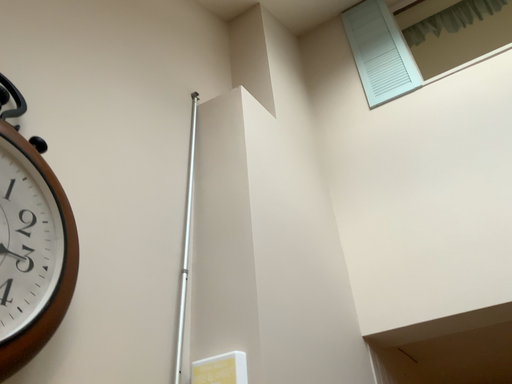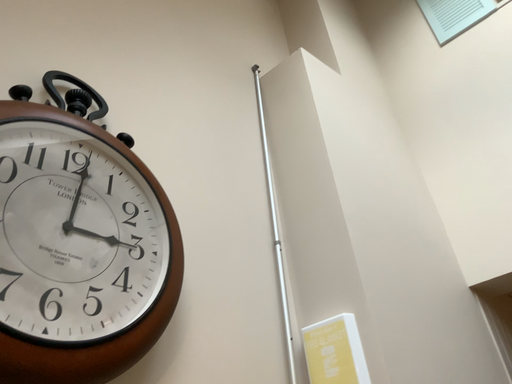
Question: How did the camera likely rotate when shooting the video?

Choices:
 (A) rotated left
 (B) rotated right

Answer: (A)